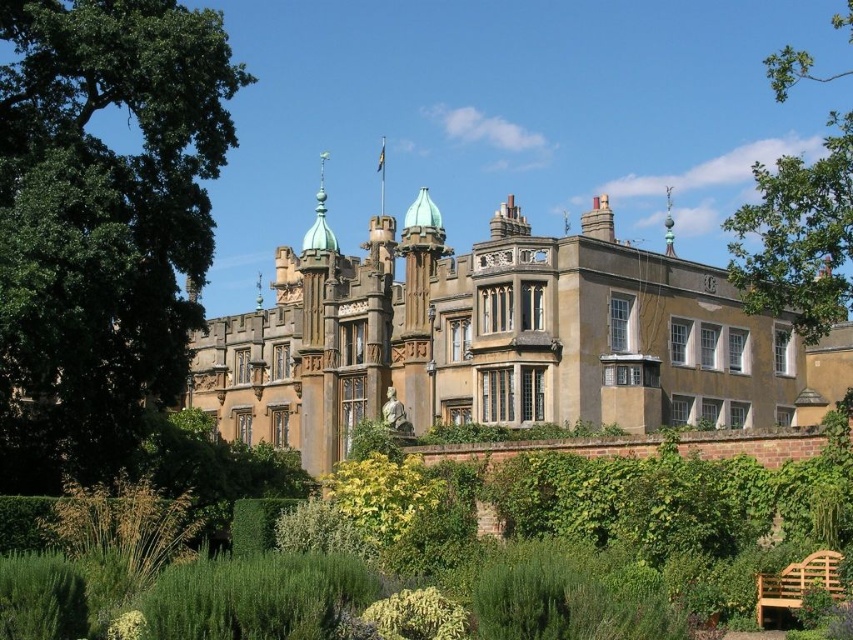
You are standing at point (567, 278) and want to walk to the statue at the base of the central section of the historic building. The statue is located at point 0.333, 0.667. Given that the distance between these two points is 81.72 meters, will you need to walk more than 100 meters to reach the statue?

The distance between point (567, 278) and the statue at the base of the central section is 81.72 meters, so you will not need to walk more than 100 meters to reach the statue.

You are a visitor standing in front of the historic building. You see the green leafy hedge at center and the light brown wooden bench at lower right. Which object is positioned higher relative to the other?

The green leafy hedge at center is above the light brown wooden bench at lower right, so it is positioned higher.

You are standing in front of the grand historic building and want to take a photo that includes the golden stone palace at center. Where should you position yourself to ensure it is centered in your camera frame?

To center the golden stone palace at center in your camera frame, position yourself directly in front of the coordinates point at (494, 337) where the golden stone palace at center is located.